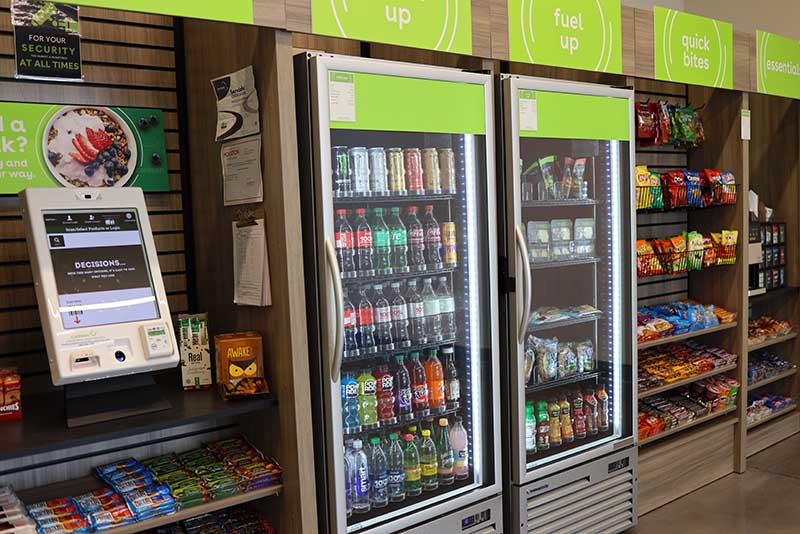
The height and width of the screenshot is (534, 800). I want to click on fridge lights, so click(x=617, y=261), click(x=477, y=297).